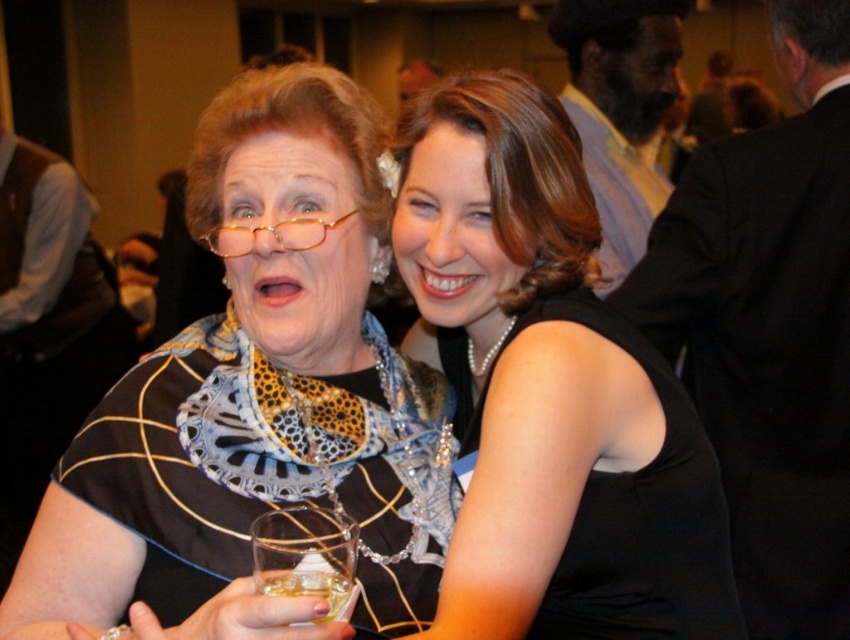
Does clear glass at center have a greater width compared to translucent glass at lower center?

Yes, clear glass at center is wider than translucent glass at lower center.

In the scene shown: Does clear glass at center come in front of translucent glass at lower center?

Yes, it is.

Where is `clear glass at center`? Image resolution: width=850 pixels, height=640 pixels. clear glass at center is located at coordinates (306, 556).

Can you confirm if pearl necklace at upper center is thinner than clear glass at center?

Incorrect, pearl necklace at upper center's width is not less than clear glass at center's.

Which is above, pearl necklace at upper center or clear glass at center?

pearl necklace at upper center is above.

Who is more forward, (494, 298) or (337, 592)?

Point (337, 592)

Identify the location of pearl necklace at upper center. (550, 392).

Does matte black dress at center have a larger size compared to clear glass at center?

Yes, matte black dress at center is bigger than clear glass at center.

Image resolution: width=850 pixels, height=640 pixels. Describe the element at coordinates (256, 381) in the screenshot. I see `matte black dress at center` at that location.

Locate an element on the screen. matte black dress at center is located at coordinates (256, 381).